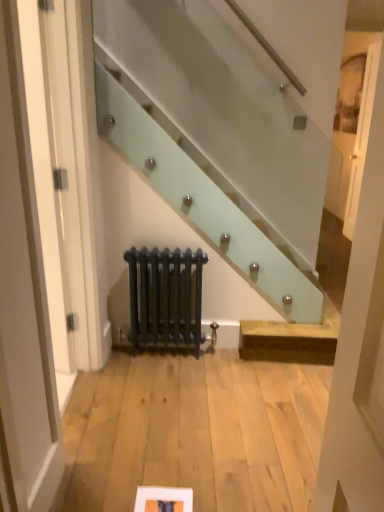
Where is `matte white picture frame at lower center`? This screenshot has height=512, width=384. matte white picture frame at lower center is located at coordinates (163, 499).

This screenshot has height=512, width=384. What are the coordinates of `white glossy door at upper right` in the screenshot? It's located at (361, 138).

Where is `matte white picture frame at lower center`? Image resolution: width=384 pixels, height=512 pixels. matte white picture frame at lower center is located at coordinates (163, 499).

Can we say matte black radiator at center lies outside matte white picture frame at lower center?

matte black radiator at center is positioned outside matte white picture frame at lower center.

Is matte black radiator at center directly adjacent to matte white picture frame at lower center?

No.

Can you tell me how much matte black radiator at center and matte white picture frame at lower center differ in facing direction?

1.14 degrees separate the facing orientations of matte black radiator at center and matte white picture frame at lower center.

Can you confirm if matte black radiator at center is taller than matte white picture frame at lower center?

Indeed, matte black radiator at center has a greater height compared to matte white picture frame at lower center.

The image size is (384, 512). I want to click on radiator on the left of white glossy door at upper right, so click(165, 297).

Is white glossy door at upper right aimed at matte black radiator at center?

No, white glossy door at upper right does not turn towards matte black radiator at center.

From a real-world perspective, between white glossy door at upper right and matte black radiator at center, who is vertically higher?

white glossy door at upper right, from a real-world perspective.

Which of these two, white glossy door at upper right or matte black radiator at center, is bigger?

With larger size is matte black radiator at center.

Is white glossy door at upper right facing away from matte white picture frame at lower center?

No, white glossy door at upper right is not facing away from matte white picture frame at lower center.

Is white glossy door at upper right in contact with matte white picture frame at lower center?

No, white glossy door at upper right is not making contact with matte white picture frame at lower center.

Can you confirm if white glossy door at upper right is positioned to the right of matte white picture frame at lower center?

Yes, white glossy door at upper right is to the right of matte white picture frame at lower center.

From the picture: Which object is closer to the camera taking this photo, white glossy door at upper right or matte white picture frame at lower center?

matte white picture frame at lower center.

Find the location of a particular element. The width and height of the screenshot is (384, 512). radiator on the left of matte white picture frame at lower center is located at coordinates (165, 297).

From the image's perspective, which is above, matte white picture frame at lower center or matte black radiator at center?

matte black radiator at center, from the image's perspective.

Would you consider matte white picture frame at lower center to be distant from matte black radiator at center?

Indeed, matte white picture frame at lower center is not near matte black radiator at center.

Is matte white picture frame at lower center taller or shorter than matte black radiator at center?

matte white picture frame at lower center is shorter than matte black radiator at center.

Are matte white picture frame at lower center and white glossy door at upper right making contact?

matte white picture frame at lower center and white glossy door at upper right are not in contact.

Considering the positions of point (186, 507) and point (370, 80), is point (186, 507) closer or farther from the camera than point (370, 80)?

Point (186, 507) is positioned closer to the camera compared to point (370, 80).

Considering the relative sizes of matte white picture frame at lower center and white glossy door at upper right in the image provided, is matte white picture frame at lower center bigger than white glossy door at upper right?

No, matte white picture frame at lower center is not bigger than white glossy door at upper right.

From the image's perspective, is matte white picture frame at lower center located above white glossy door at upper right?

No, from the image's perspective, matte white picture frame at lower center is not above white glossy door at upper right.

Can you confirm if matte black radiator at center is positioned to the right of white glossy door at upper right?

No, matte black radiator at center is not to the right of white glossy door at upper right.

This screenshot has height=512, width=384. I want to click on door behind the matte black radiator at center, so [361, 138].

How many degrees apart are the facing directions of matte black radiator at center and white glossy door at upper right?

The angle between the facing direction of matte black radiator at center and the facing direction of white glossy door at upper right is 88.2 degrees.

Are matte black radiator at center and white glossy door at upper right far apart?

Absolutely, matte black radiator at center is distant from white glossy door at upper right.

You are a GUI agent. You are given a task and a screenshot of the screen. Output one action in this format:
    pyautogui.click(x=<x>, y=<y>)
    Task: Click on the radiator to the left of matte white picture frame at lower center
    
    Given the screenshot: What is the action you would take?
    pyautogui.click(x=165, y=297)

At what (x,y) coordinates should I click in order to perform the action: click on radiator in front of the white glossy door at upper right. Please return your answer as a coordinate pair (x, y). This screenshot has width=384, height=512. Looking at the image, I should click on (165, 297).

Looking at this image, when comparing their distances from white glossy door at upper right, does matte black radiator at center or matte white picture frame at lower center seem closer?

matte black radiator at center is closer to white glossy door at upper right.

Estimate the real-world distances between objects in this image. Which object is closer to white glossy door at upper right, matte white picture frame at lower center or matte black radiator at center?

matte black radiator at center.

Which object lies further to the anchor point matte white picture frame at lower center, white glossy door at upper right or matte black radiator at center?

white glossy door at upper right lies further to matte white picture frame at lower center than the other object.

Which object lies further to the anchor point matte black radiator at center, matte white picture frame at lower center or white glossy door at upper right?

Among the two, white glossy door at upper right is located further to matte black radiator at center.

Estimate the real-world distances between objects in this image. Which object is closer to matte black radiator at center, white glossy door at upper right or matte white picture frame at lower center?

matte white picture frame at lower center is closer to matte black radiator at center.

Considering their positions, is matte black radiator at center positioned closer to matte white picture frame at lower center than white glossy door at upper right?

matte black radiator at center is closer to matte white picture frame at lower center.

In order to click on radiator located between matte white picture frame at lower center and white glossy door at upper right in the depth direction in this screenshot , I will do `click(165, 297)`.